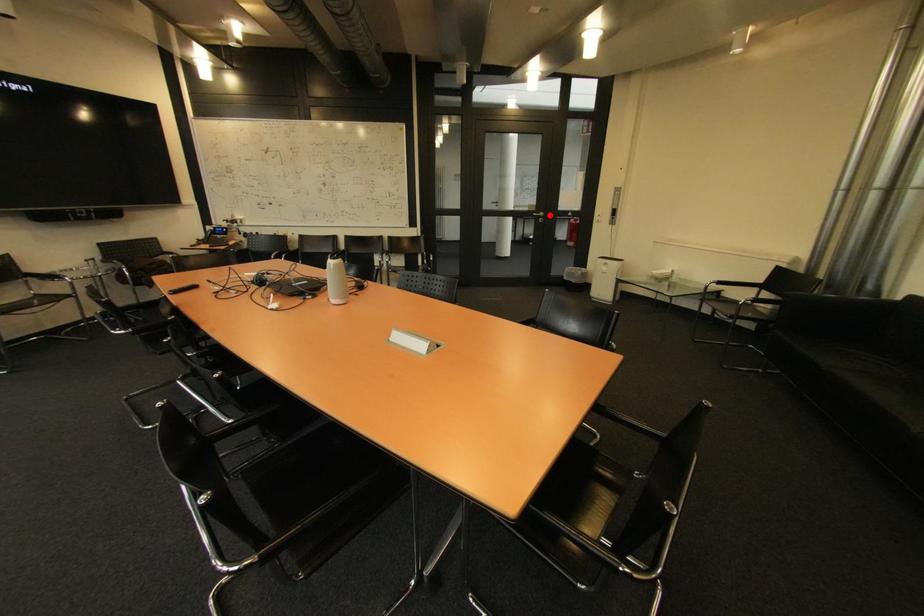
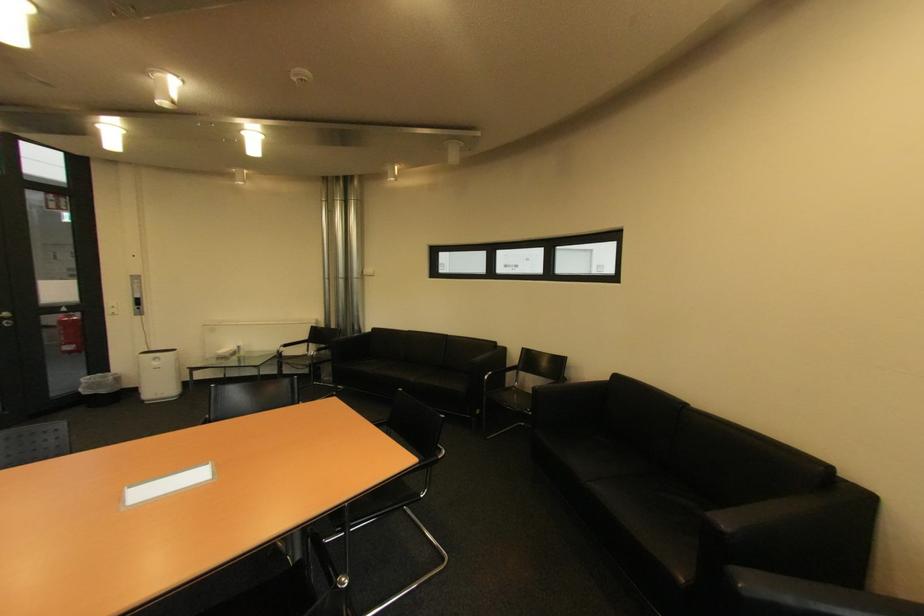
The point at the highlighted location is marked in the first image. Where is the corresponding point in the second image?

(14, 315)